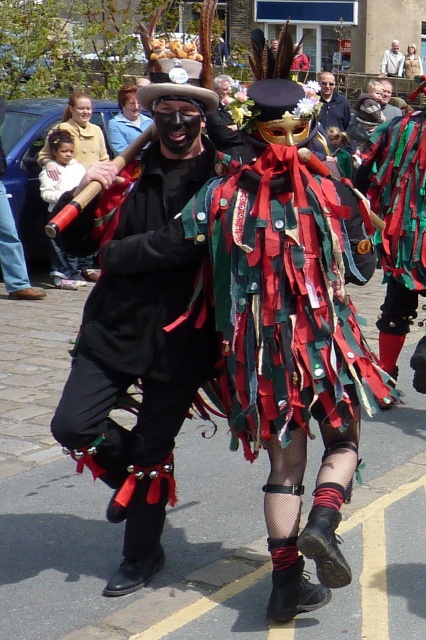
Question: Can you confirm if smooth blue shirt at center is positioned to the right of white textured fabric at center?

Choices:
 (A) yes
 (B) no

Answer: (B)

Question: Which object appears farthest from the camera in this image?

Choices:
 (A) white textured fabric at center
 (B) shiny metallic mask at center
 (C) smooth blue shirt at center

Answer: (A)

Question: Is shiny metallic mask at center bigger than smooth blue shirt at center?

Choices:
 (A) no
 (B) yes

Answer: (A)

Question: Does shiny metallic mask at center have a greater width compared to smooth blue shirt at center?

Choices:
 (A) yes
 (B) no

Answer: (A)

Question: Which object is positioned closest to the red-green fabric strips at center?

Choices:
 (A) smooth blue shirt at center
 (B) white textured fabric at center

Answer: (A)

Question: Which point is farther to the camera?

Choices:
 (A) (397, 67)
 (B) (166, 358)
 (C) (334, 90)
 (D) (348, 300)

Answer: (A)